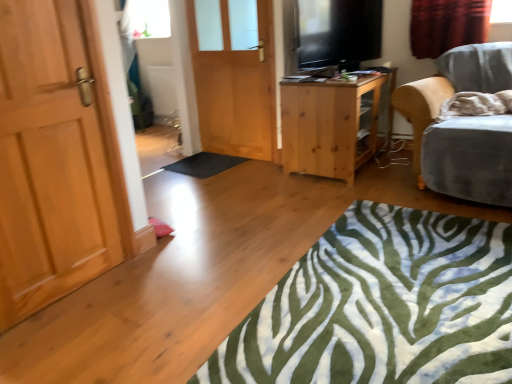
I want to click on empty space that is in between light brown wooden door at left, the 1th door from the left, and velvet grey chair at right, so click(253, 239).